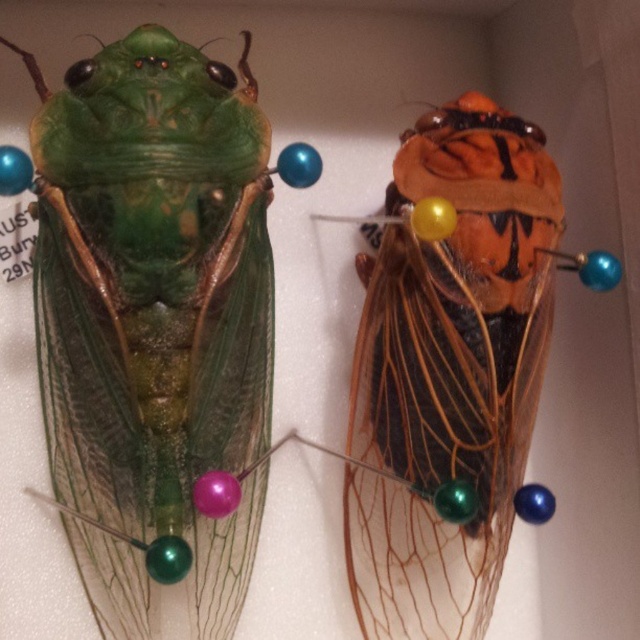
Can you confirm if green translucent wing at center is positioned to the right of orange matte cicada at center?

In fact, green translucent wing at center is to the left of orange matte cicada at center.

Who is lower down, green translucent wing at center or orange matte cicada at center?

orange matte cicada at center is lower down.

Measure the distance between green translucent wing at center and camera.

A distance of 3.89 feet exists between green translucent wing at center and camera.

The image size is (640, 640). Identify the location of green translucent wing at center. (156, 323).